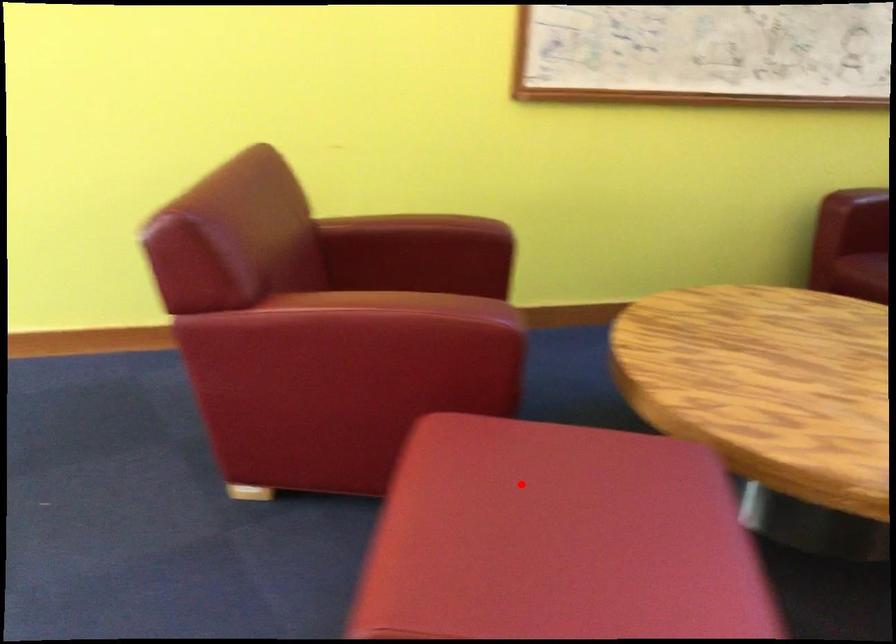
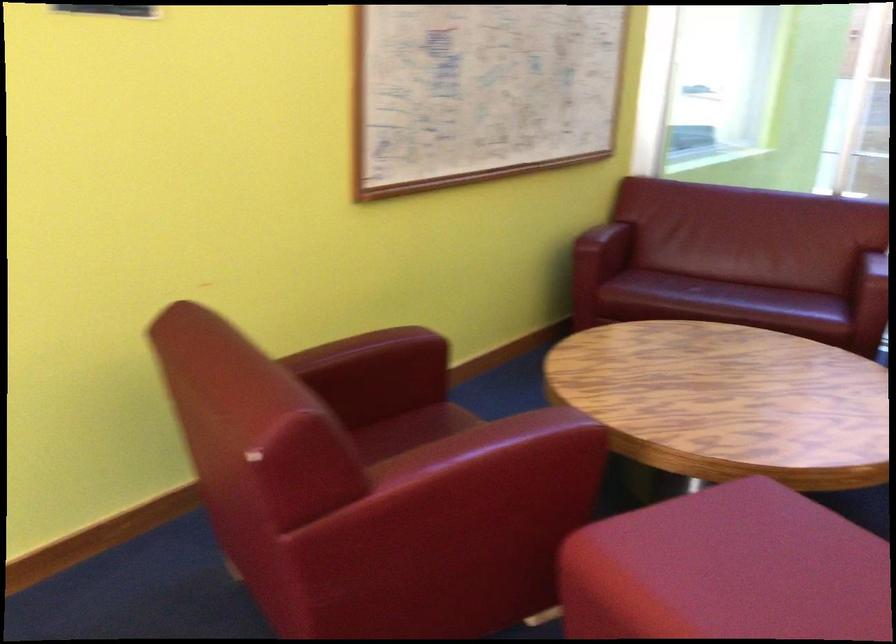
Question: I am providing you with two images of the same scene from different viewpoints. A red point is marked on the first image. Is the red point's position out of view in image 2?

Choices:
 (A) Yes
 (B) No

Answer: (B)